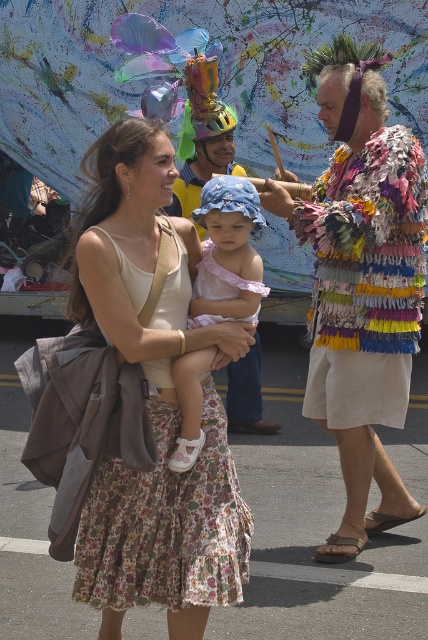
Can you confirm if floral cotton dress at center is thinner than matte pink fabric dress at center?

No, floral cotton dress at center is not thinner than matte pink fabric dress at center.

You are a GUI agent. You are given a task and a screenshot of the screen. Output one action in this format:
    pyautogui.click(x=<x>, y=<y>)
    Task: Click on the floral cotton dress at center
    This screenshot has width=428, height=640.
    Given the screenshot: What is the action you would take?
    pyautogui.click(x=154, y=403)